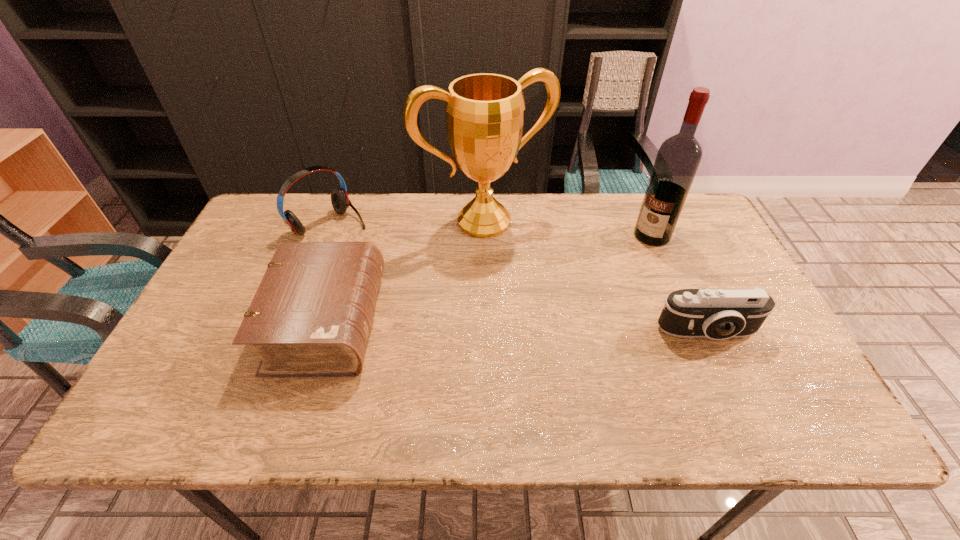
I want to click on vacant region located 0.190m on the front-facing side of the award, so click(x=539, y=282).

I want to click on vacant area situated on the front-facing side of the award, so 539,282.

Find the location of a particular element. vacant space situated on the front-facing side of the award is located at coordinates (527, 266).

I want to click on free space located 0.230m on the front and back of the alcohol, so click(x=606, y=287).

This screenshot has height=540, width=960. Find the location of `free point located 0.060m on the front and back of the alcohol`. free point located 0.060m on the front and back of the alcohol is located at coordinates (635, 255).

Image resolution: width=960 pixels, height=540 pixels. What are the coordinates of `vacant point located on the front and back of the alcohol` in the screenshot? It's located at (623, 267).

The image size is (960, 540). Find the location of `headset located in the far edge section of the desktop`. headset located in the far edge section of the desktop is located at coordinates pyautogui.click(x=340, y=201).

The width and height of the screenshot is (960, 540). I want to click on award at the far edge, so click(x=484, y=112).

Find the location of a particular element. alcohol situated at the far edge is located at coordinates (678, 158).

Identify the location of object present at the near edge. This screenshot has height=540, width=960. (311, 316).